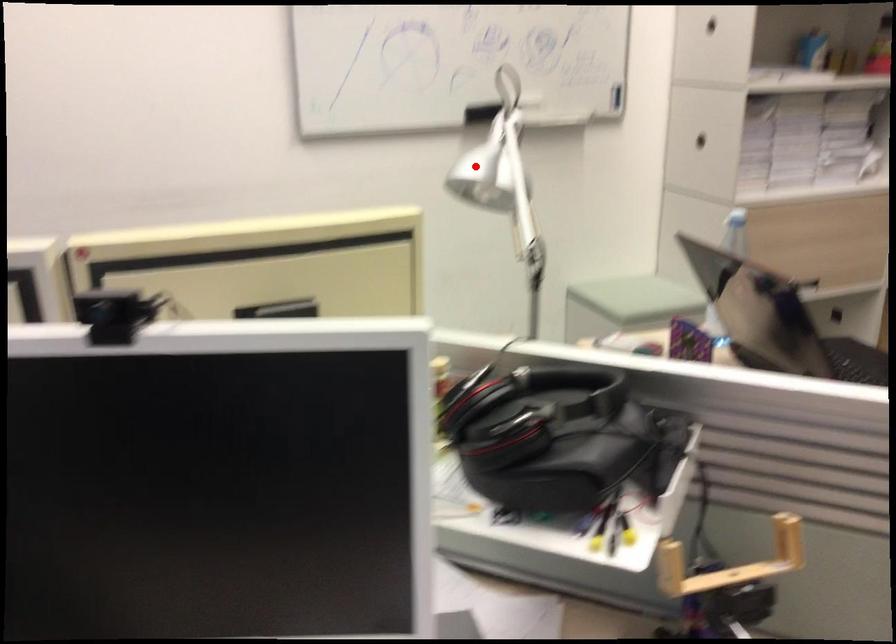
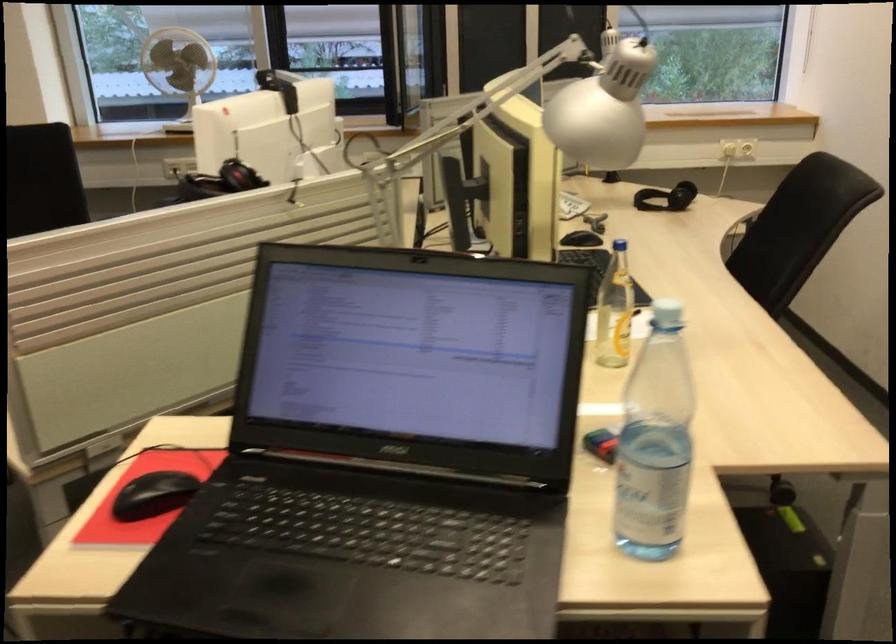
Question: A red point is marked in image1. In image2, is the corresponding 3D point closer to the camera or farther? Reply with the corresponding letter.

Choices:
 (A) The corresponding 3D point is closer.
 (B) The corresponding 3D point is farther.

Answer: (A)